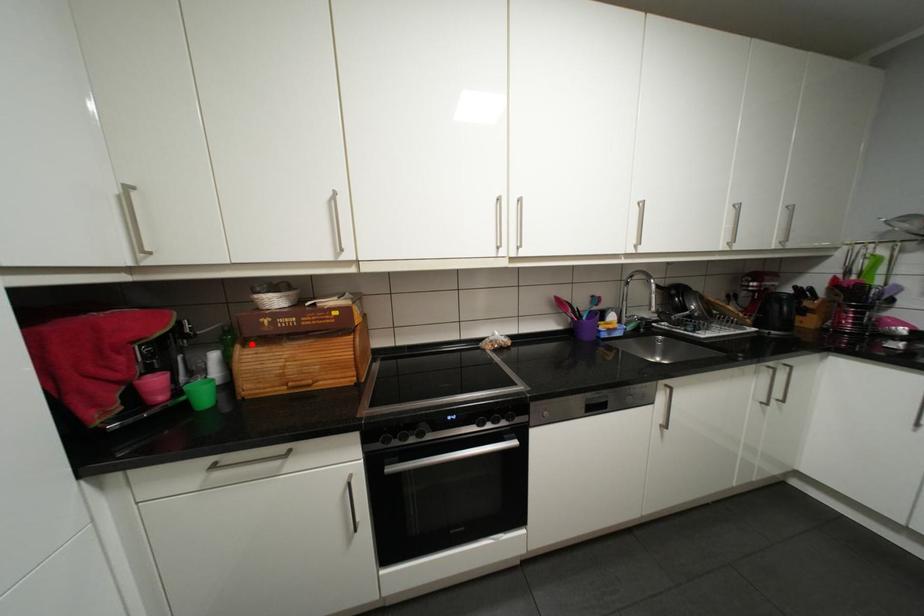
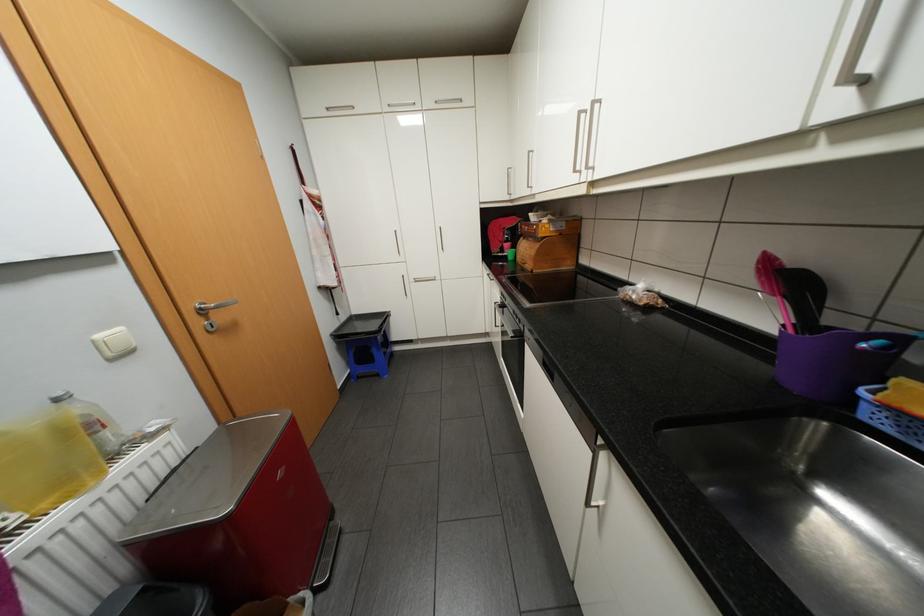
Find the pixel in the second image that matches the highlighted location in the first image.

(531, 237)